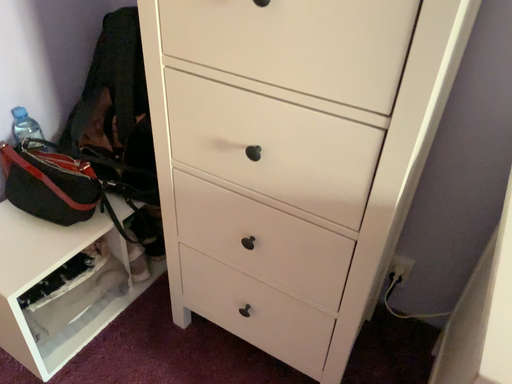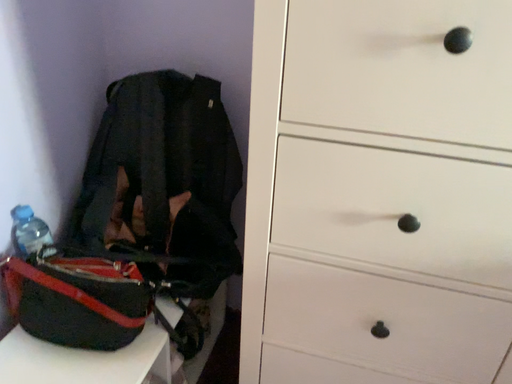
Question: Which way did the camera rotate in the video?

Choices:
 (A) rotated right
 (B) rotated left

Answer: (A)